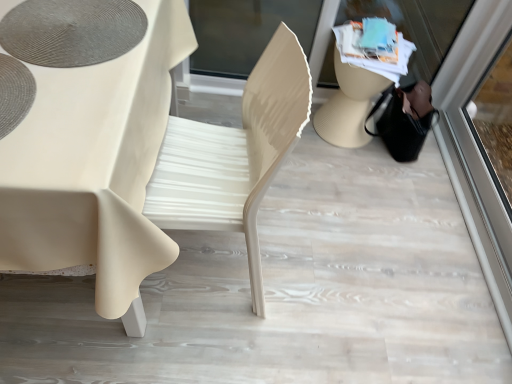
Question: Can you confirm if transparent glass shop window at upper right is taller than transparent glass screen door at right?

Choices:
 (A) no
 (B) yes

Answer: (A)

Question: Is transparent glass shop window at upper right bigger than transparent glass screen door at right?

Choices:
 (A) no
 (B) yes

Answer: (B)

Question: Is transparent glass shop window at upper right turned away from transparent glass screen door at right?

Choices:
 (A) yes
 (B) no

Answer: (B)

Question: Is transparent glass screen door at right inside transparent glass shop window at upper right?

Choices:
 (A) no
 (B) yes

Answer: (A)

Question: Is transparent glass shop window at upper right positioned beyond the bounds of transparent glass screen door at right?

Choices:
 (A) yes
 (B) no

Answer: (A)

Question: In terms of size, does transparent glass shop window at upper right appear bigger or smaller than transparent glass screen door at right?

Choices:
 (A) big
 (B) small

Answer: (A)

Question: Is transparent glass shop window at upper right taller or shorter than transparent glass screen door at right?

Choices:
 (A) tall
 (B) short

Answer: (B)

Question: In terms of width, does transparent glass shop window at upper right look wider or thinner when compared to transparent glass screen door at right?

Choices:
 (A) thin
 (B) wide

Answer: (B)

Question: Is transparent glass shop window at upper right to the left or to the right of transparent glass screen door at right in the image?

Choices:
 (A) left
 (B) right

Answer: (A)

Question: Looking at their shapes, would you say matte beige chair at center is wider or thinner than matte white table at center?

Choices:
 (A) thin
 (B) wide

Answer: (A)

Question: Considering the positions of matte beige chair at center and matte white table at center in the image, is matte beige chair at center bigger or smaller than matte white table at center?

Choices:
 (A) big
 (B) small

Answer: (B)

Question: Is matte beige chair at center inside or outside of matte white table at center?

Choices:
 (A) outside
 (B) inside

Answer: (B)

Question: In the image, is matte beige chair at center positioned in front of or behind matte white table at center?

Choices:
 (A) front
 (B) behind

Answer: (B)

Question: From a real-world perspective, is transparent glass shop window at upper right positioned above or below matte gray placemat at upper left?

Choices:
 (A) above
 (B) below

Answer: (B)

Question: Does point (206, 4) appear closer or farther from the camera than point (58, 23)?

Choices:
 (A) farther
 (B) closer

Answer: (A)